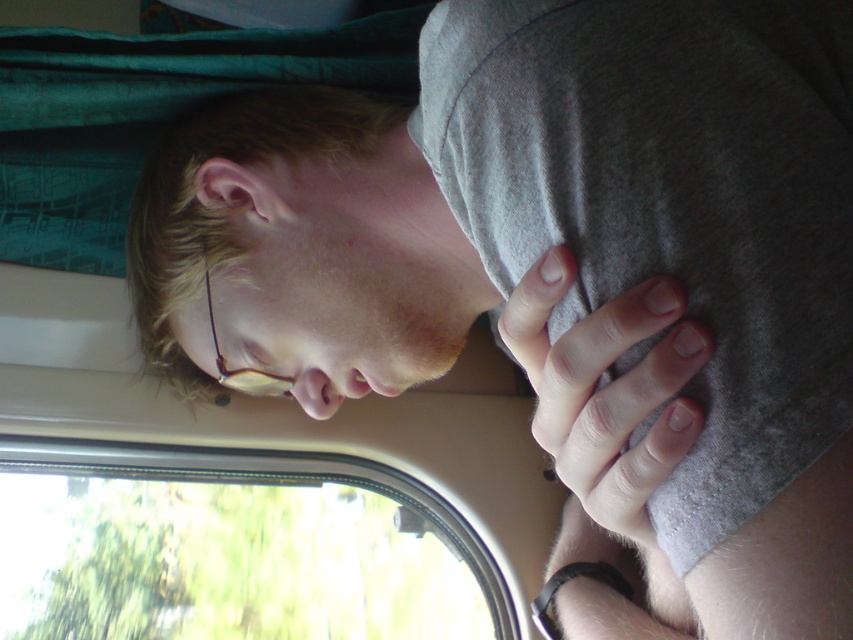
Question: Which of these objects is positioned closest to the white matte hand at center?

Choices:
 (A) transparent glass window at lower left
 (B) matte gray hair at upper center
 (C) pink smooth nose at center

Answer: (B)

Question: Can you confirm if transparent glass window at lower left is positioned to the right of white matte hand at center?

Choices:
 (A) yes
 (B) no

Answer: (B)

Question: Can you confirm if transparent glass window at lower left is positioned to the left of white matte hand at center?

Choices:
 (A) no
 (B) yes

Answer: (B)

Question: Which object is farther from the camera taking this photo?

Choices:
 (A) white matte hand at center
 (B) transparent glass window at lower left

Answer: (B)

Question: Among these objects, which one is farthest from the camera?

Choices:
 (A) transparent glass window at lower left
 (B) matte gray hair at upper center
 (C) pink smooth nose at center
 (D) white matte hand at center

Answer: (A)

Question: Does matte gray hair at upper center have a smaller size compared to white matte hand at center?

Choices:
 (A) yes
 (B) no

Answer: (B)